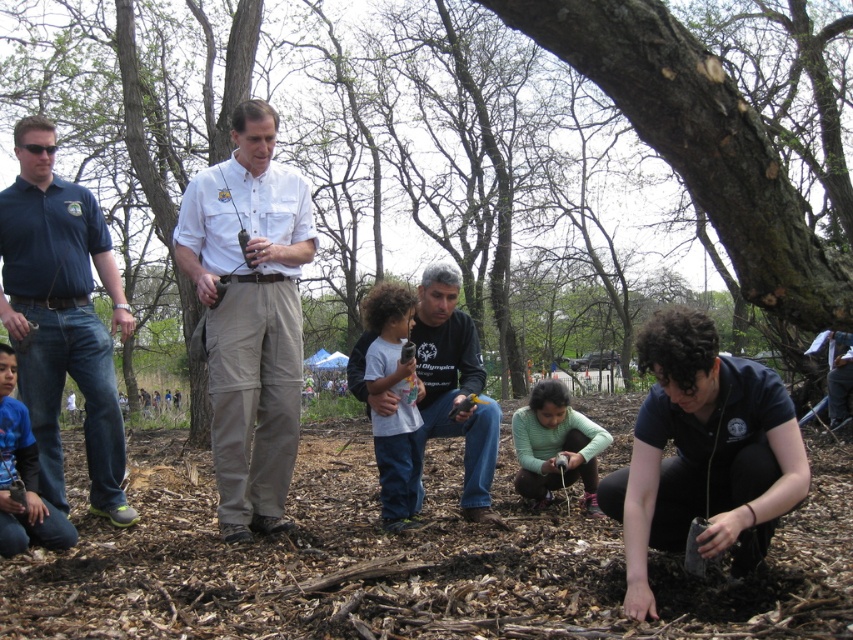
You are standing at the center of the park. Where is the dark blue shirt at lower right located?

The dark blue shirt at lower right is located at point (703,452).

You are standing in the park scene and want to place a new bench between the two points labeled point (44,364) and point (438,332). Which point should the bench be closer to in order to be nearer to the viewer?

The bench should be placed closer to point (44,364) because it is closer to the viewer than point (438,332).